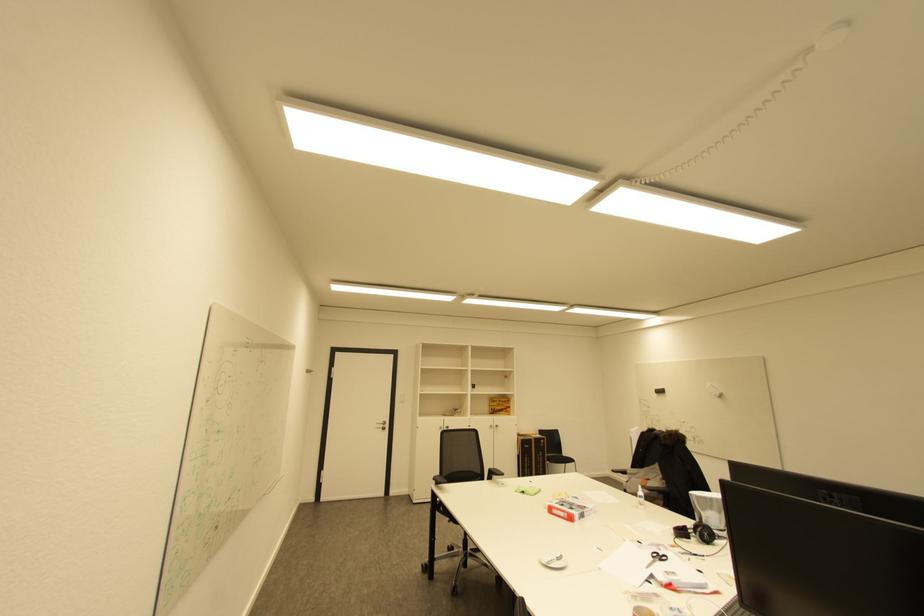
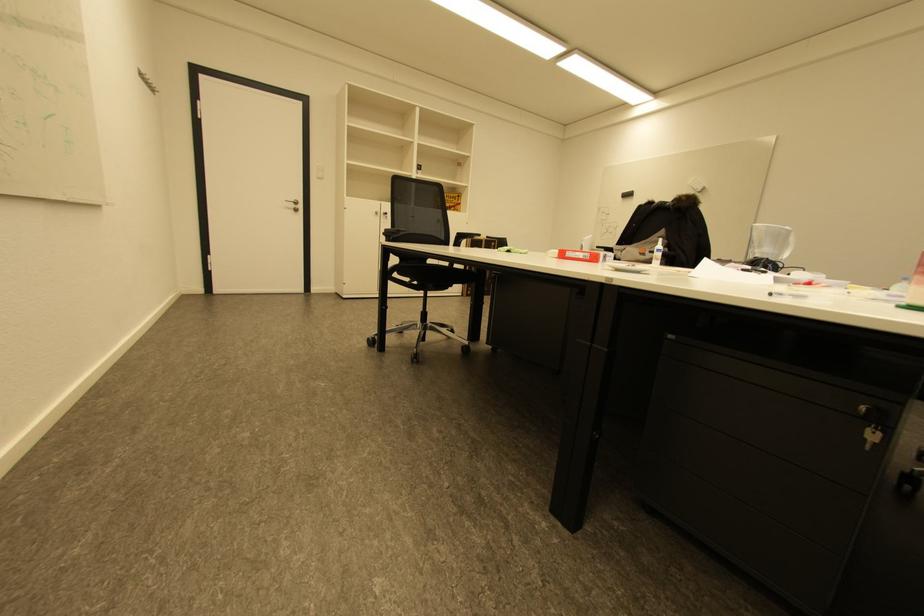
In a continuous first-person perspective shot, in which direction is the camera moving?

The cameraman moved toward left, forward.